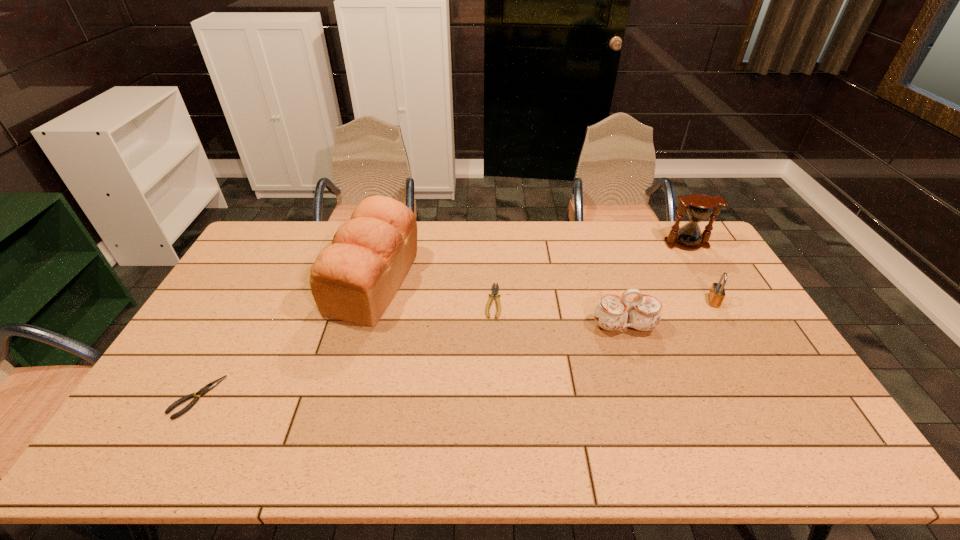
Where is `empty location between the tallest object and the third object from left to right`? The image size is (960, 540). empty location between the tallest object and the third object from left to right is located at coordinates (434, 292).

Image resolution: width=960 pixels, height=540 pixels. I want to click on vacant space that's between the second tallest object and the padlock, so click(700, 273).

In order to click on free space between the nearest object and the fourth object from right to left in this screenshot , I will do `click(345, 349)`.

The width and height of the screenshot is (960, 540). I want to click on vacant space that is in between the right pliers and the hourglass, so click(x=589, y=273).

At what (x,y) coordinates should I click in order to perform the action: click on free spot between the nearer pliers and the hourglass. Please return your answer as a coordinate pair (x, y). Looking at the image, I should click on (442, 321).

The width and height of the screenshot is (960, 540). Find the location of `vacant region between the tallest object and the nearest object`. vacant region between the tallest object and the nearest object is located at coordinates (285, 340).

This screenshot has width=960, height=540. What are the coordinates of `unoccupied position between the fourth object from left to right and the farther pliers` in the screenshot? It's located at (559, 314).

Locate an element on the screen. The width and height of the screenshot is (960, 540). the third closest object to the hourglass is located at coordinates (494, 291).

Identify which object is the closest to the right pliers. Please provide its 2D coordinates. Your answer should be formatted as a tuple, i.e. [(x, y)], where the tuple contains the x and y coordinates of a point satisfying the conditions above.

[(354, 280)]

The width and height of the screenshot is (960, 540). In order to click on vacant point that satisfies the following two spatial constraints: 1. on the back side of the right pliers; 2. on the right side of the leftmost object in this screenshot , I will do `click(251, 301)`.